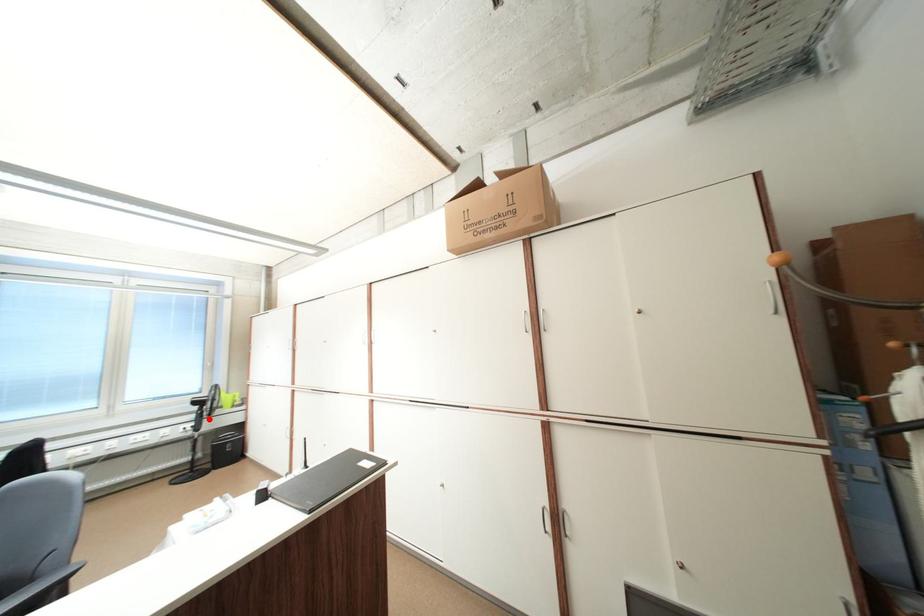
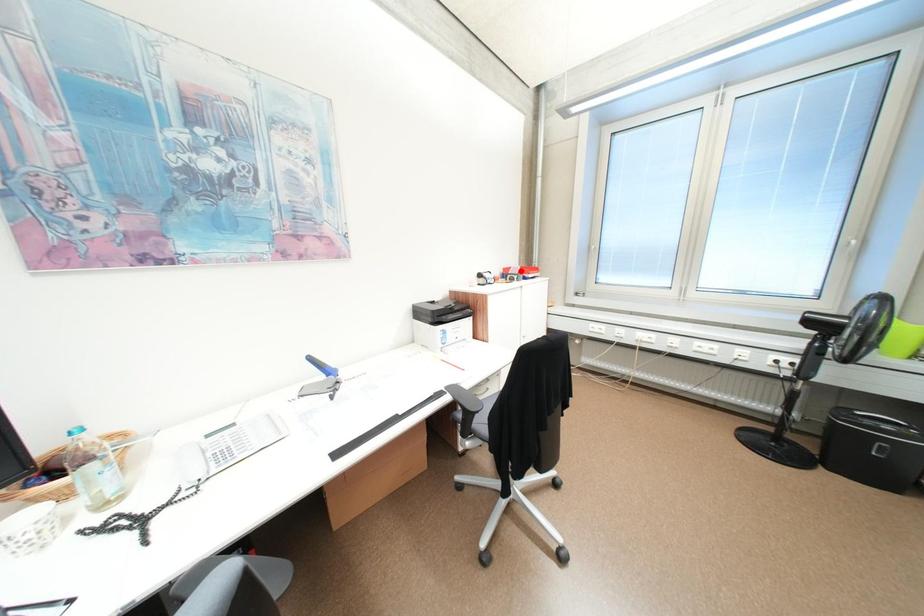
I am providing you with two images of the same scene from different viewpoints. A red point is marked on the first image and another point is marked on the second image. Is the red point in image1 aligned with the point shown in image2?

No